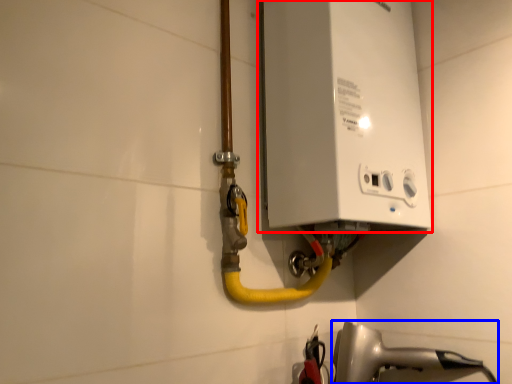
Question: Which of the following is the closest to the observer, appliance (highlighted by a red box) or plumbing fixture (highlighted by a blue box)?

Choices:
 (A) appliance
 (B) plumbing fixture

Answer: (A)